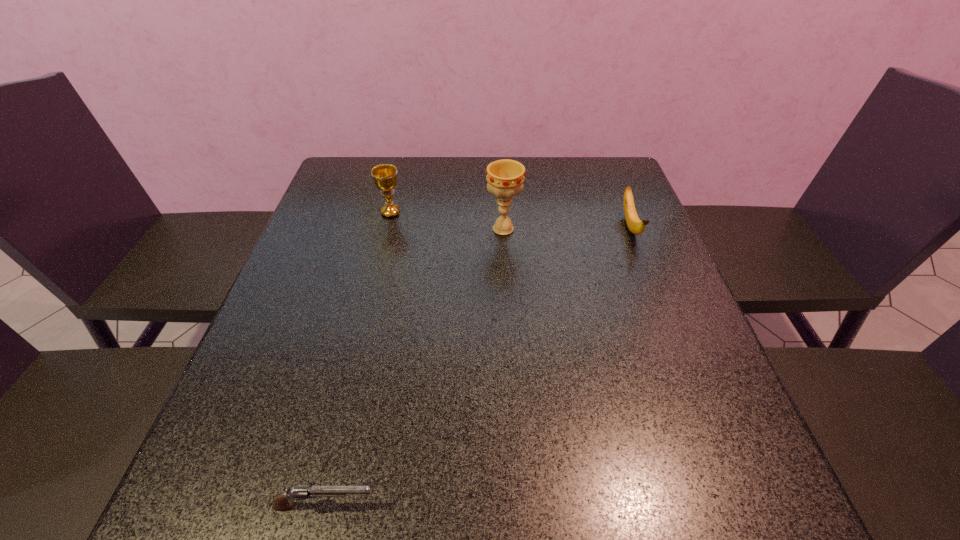
Identify the location of vacant area at the near left corner. (255, 479).

What are the coordinates of `free space at the far right corner of the desktop` in the screenshot? It's located at click(609, 174).

Where is `vacant region at the near right corner of the desktop`? The image size is (960, 540). vacant region at the near right corner of the desktop is located at coordinates (769, 484).

At what (x,y) coordinates should I click in order to perform the action: click on free space between the banana and the shortest object. Please return your answer as a coordinate pair (x, y). This screenshot has width=960, height=540. Looking at the image, I should click on point(478,366).

This screenshot has width=960, height=540. I want to click on free space between the third shortest object and the third object from left to right, so click(x=447, y=221).

You are a GUI agent. You are given a task and a screenshot of the screen. Output one action in this format:
    pyautogui.click(x=<x>, y=<y>)
    Task: Click on the vacant space that's between the gun and the banana
    This screenshot has width=960, height=540.
    Given the screenshot: What is the action you would take?
    point(478,366)

Locate an element on the screen. The image size is (960, 540). vacant area between the tallest object and the third tallest object is located at coordinates (566, 228).

Locate an element on the screen. Image resolution: width=960 pixels, height=540 pixels. free space between the shorter chalice and the gun is located at coordinates (358, 359).

Where is `vacant region between the gun and the right chalice`? The image size is (960, 540). vacant region between the gun and the right chalice is located at coordinates (414, 367).

Find the location of `empty space between the third shortest object and the gun`. empty space between the third shortest object and the gun is located at coordinates (358, 359).